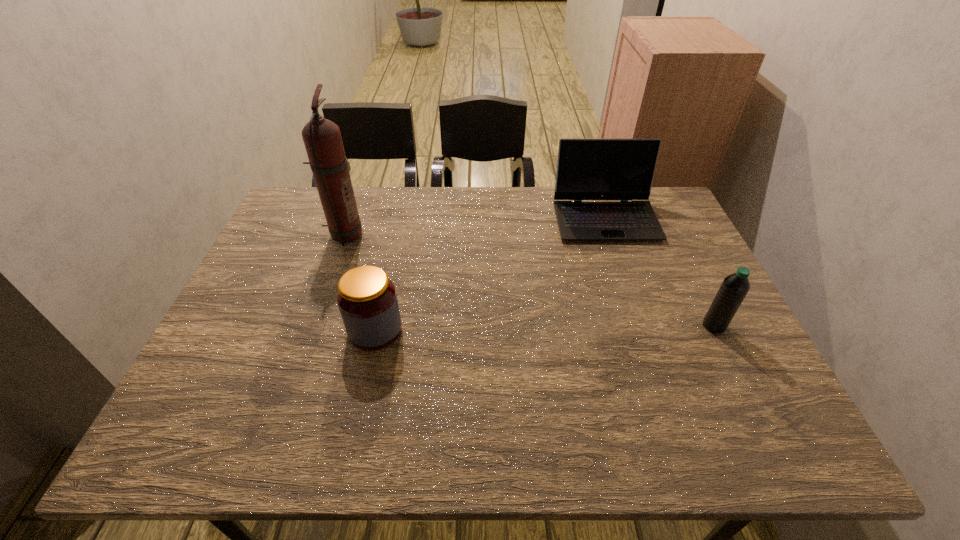
You are a GUI agent. You are given a task and a screenshot of the screen. Output one action in this format:
    pyautogui.click(x=<x>, y=<y>)
    Task: Click on the laptop computer situated at the far edge
    This screenshot has width=960, height=540.
    Given the screenshot: What is the action you would take?
    pyautogui.click(x=587, y=169)

Find the location of a particular element. object that is at the left edge is located at coordinates (322, 138).

What are the coordinates of `laptop computer situated at the right edge` in the screenshot? It's located at (587, 169).

Where is `water bottle positioned at the right edge`? Image resolution: width=960 pixels, height=540 pixels. water bottle positioned at the right edge is located at coordinates (734, 288).

Find the location of a particular element. The image size is (960, 540). object that is at the far left corner is located at coordinates (322, 138).

The image size is (960, 540). What are the coordinates of `object situated at the far right corner` in the screenshot? It's located at (587, 169).

You are a GUI agent. You are given a task and a screenshot of the screen. Output one action in this format:
    pyautogui.click(x=<x>, y=<y>)
    Task: Click on the vacant region at the far edge of the desktop
    This screenshot has height=540, width=960.
    Given the screenshot: What is the action you would take?
    pyautogui.click(x=368, y=192)

Where is `vacant space at the near edge`? The height and width of the screenshot is (540, 960). vacant space at the near edge is located at coordinates (x=696, y=422).

Find the location of `free region at the left edge of the desktop`. free region at the left edge of the desktop is located at coordinates (186, 406).

I want to click on vacant region at the far left corner of the desktop, so click(x=324, y=218).